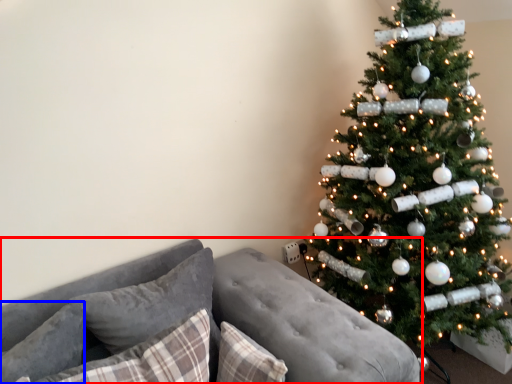
Question: Which point is closer to the camera, studio couch (highlighted by a red box) or pillow (highlighted by a blue box)?

Choices:
 (A) studio couch
 (B) pillow

Answer: (A)